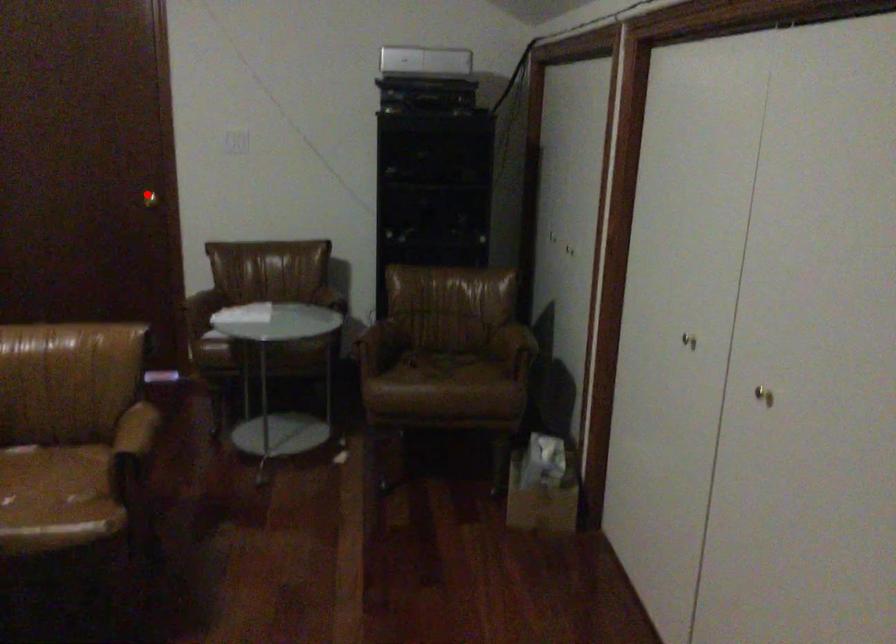
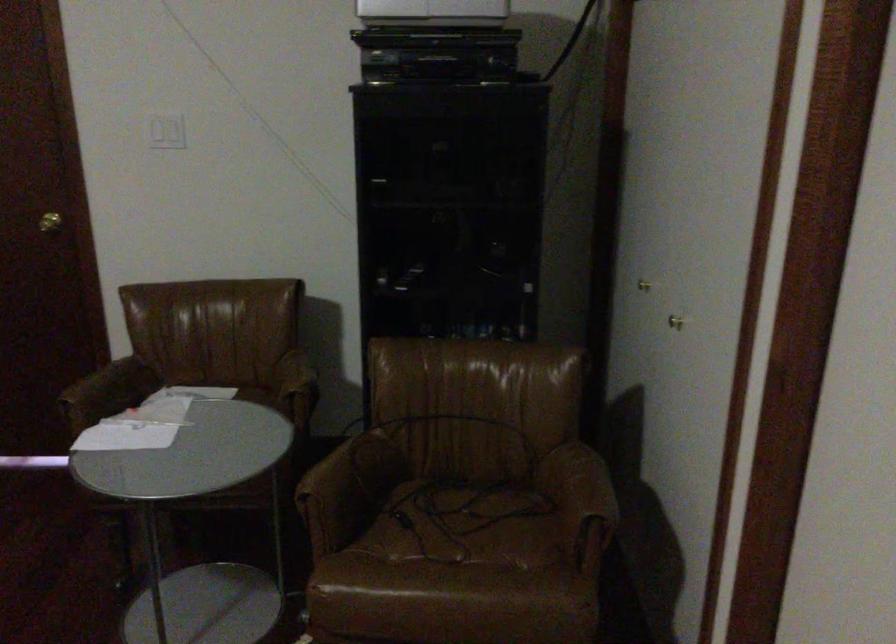
Locate, in the second image, the point that corresponds to the highlighted location in the first image.

(49, 222)